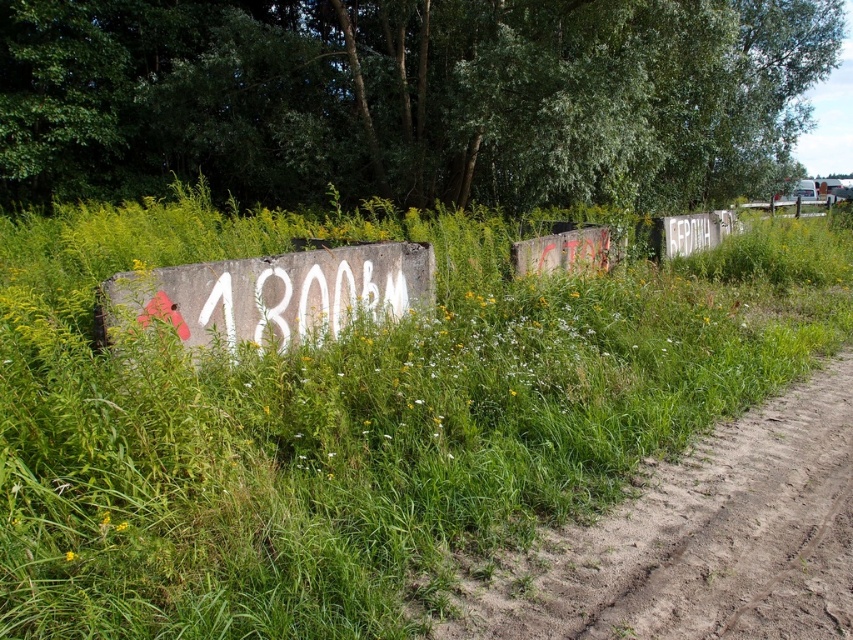
You are a hiker trying to follow a path through the rural area shown. You see the brown sandy dirt track at lower right and the white painted graffiti at center. Which direction should you go to stay on the path?

The brown sandy dirt track at lower right is located below the white painted graffiti at center, so to stay on the path, you should head towards the brown sandy dirt track at lower right which is positioned lower down from the graffiti.

You are a surveyor measuring distances in the rural scene. You need to determine if a 3.5 meter measuring tape can reach from the brown sandy dirt track at lower right to the white painted graffiti at center. Can it?

The distance between the brown sandy dirt track at lower right and the white painted graffiti at center is 3.46 meters, so the 3.5 meter measuring tape can reach between them since it is slightly longer than the required distance.